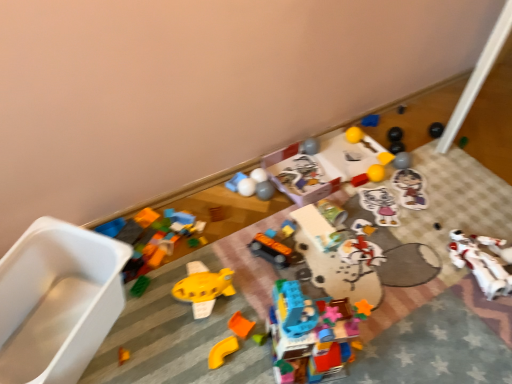
Image resolution: width=512 pixels, height=384 pixels. Identify the location of vacant space that is to the left of matte gray ball at center, which is the 11th toy from right to left. (219, 199).